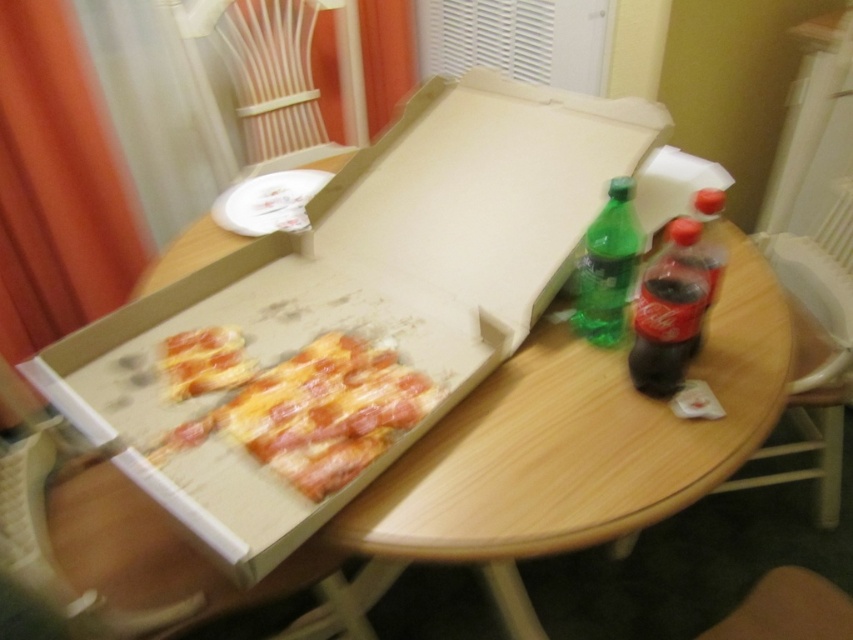
What is the 2D coordinate of the wooden at center?

The wooden at center is located at point (576, 448).

You are at a restaurant table and see the cardboard box at center and the cheesy pepperoni pizza at center. Which item is located to the right of the other?

The cardboard box at center is to the right of the cheesy pepperoni pizza at center.